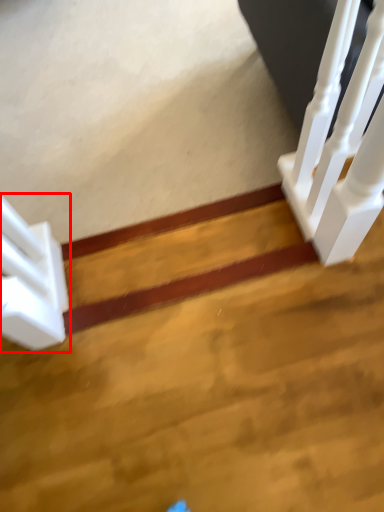
Question: From the image's perspective, considering the relative positions of stairs (annotated by the red box) and stairwell in the image provided, where is stairs (annotated by the red box) located with respect to the staircase?

Choices:
 (A) above
 (B) below

Answer: (B)